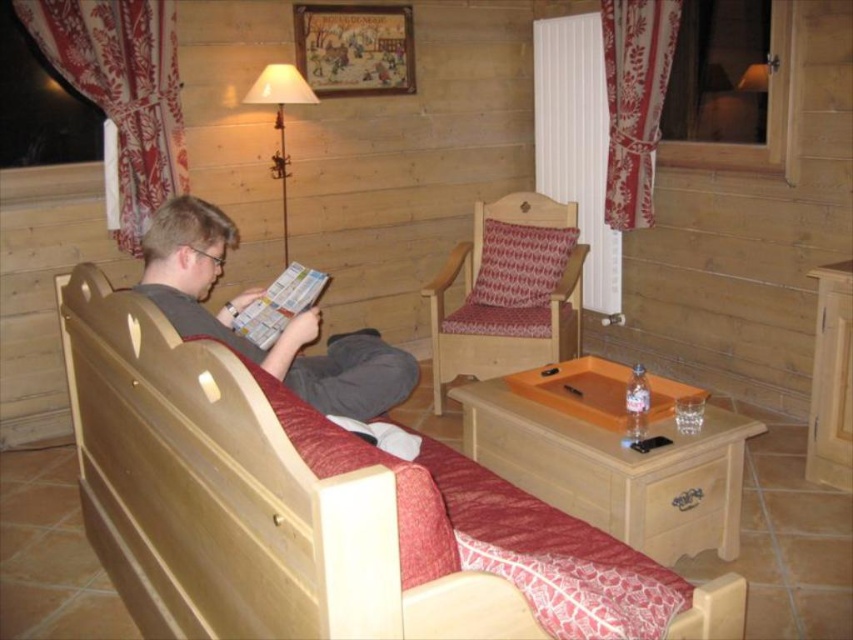
Does wooden bed at center have a smaller size compared to matte metal lamp at upper center?

Incorrect, wooden bed at center is not smaller in size than matte metal lamp at upper center.

Who is positioned more to the right, wooden bed at center or matte metal lamp at upper center?

From the viewer's perspective, wooden bed at center appears more on the right side.

Is point (326, 484) in front of point (281, 116)?

Yes.

At what (x,y) coordinates should I click in order to perform the action: click on wooden bed at center. Please return your answer as a coordinate pair (x, y). This screenshot has height=640, width=853. Looking at the image, I should click on (236, 499).

Between point (439, 323) and point (289, 310), which one is positioned behind?

The point (439, 323) is more distant.

Is point (550, 266) farther from camera compared to point (276, 330)?

Yes, it is.

Does point (496, 304) come farther from viewer compared to point (248, 321)?

That is True.

Find the location of a particular element. This screenshot has width=853, height=640. wooden armchair with patterned cushion at center is located at coordinates (509, 291).

Looking at this image, is wooden armchair with patterned cushion at center above matte metal lamp at upper center?

No.

The height and width of the screenshot is (640, 853). Find the location of `wooden armchair with patterned cushion at center`. wooden armchair with patterned cushion at center is located at coordinates (509, 291).